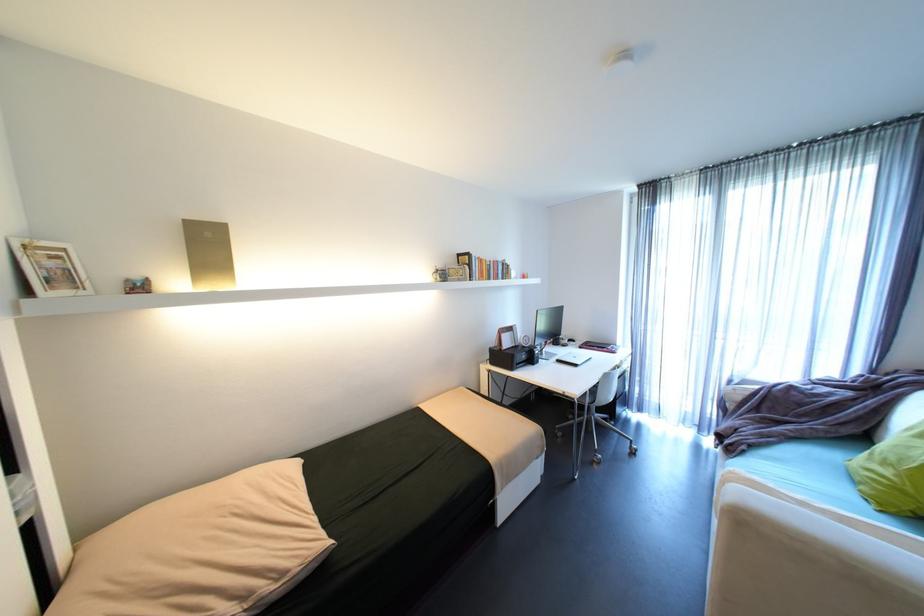
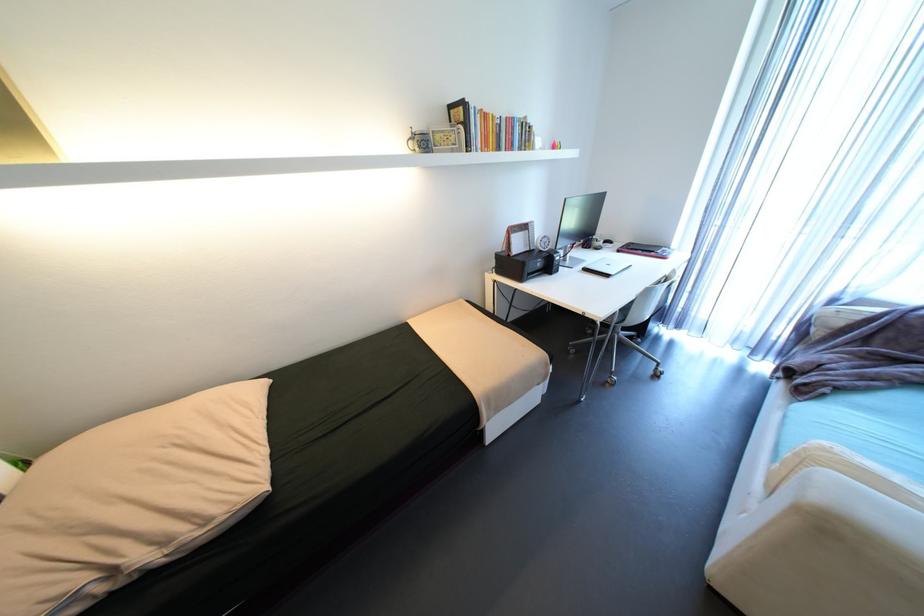
Which direction would the cameraman need to move to produce the second image?

The cameraman walked toward right, forward.